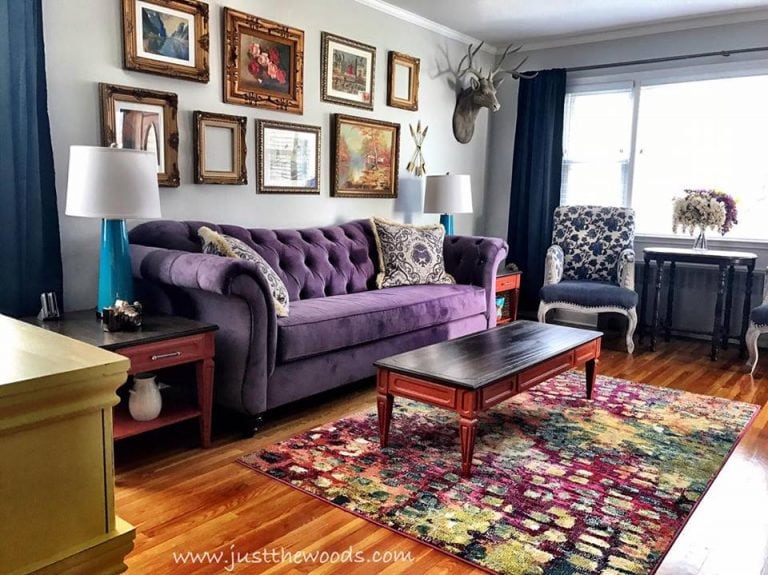
This screenshot has width=768, height=575. I want to click on hard wood flooring, so click(186, 521).